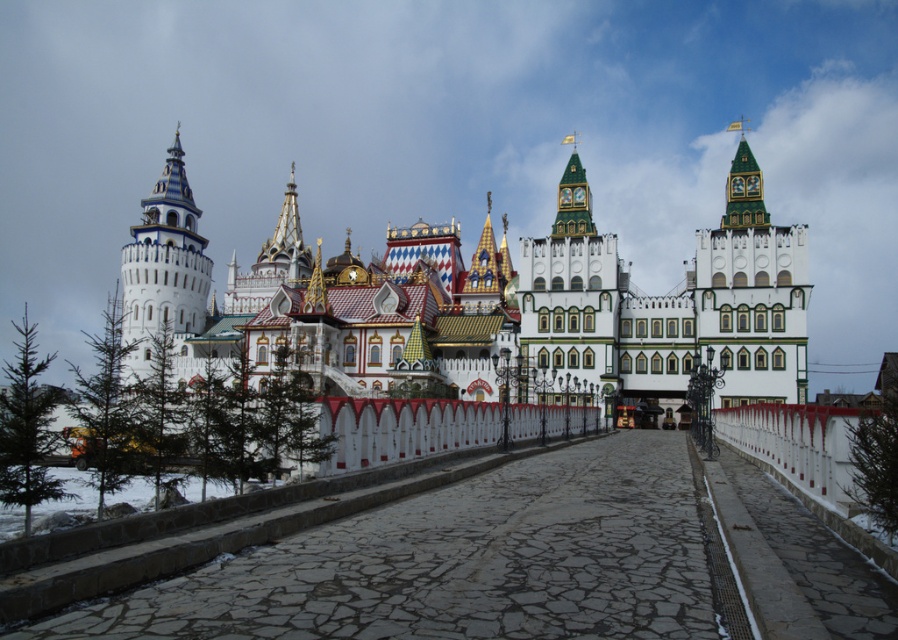
Question: Among these objects, which one is farthest from the camera?

Choices:
 (A) white painted stone tower at right
 (B) white painted stone castle at center
 (C) white painted wood clock tower at center
 (D) white painted stone tower at left

Answer: (C)

Question: Considering the relative positions of white painted stone tower at right and white painted stone tower at left in the image provided, where is white painted stone tower at right located with respect to white painted stone tower at left?

Choices:
 (A) above
 (B) below

Answer: (A)

Question: Does white painted stone tower at right appear under white painted wood clock tower at center?

Choices:
 (A) no
 (B) yes

Answer: (A)

Question: Among these points, which one is farthest from the camera?

Choices:
 (A) (198, 310)
 (B) (600, 292)
 (C) (753, 401)

Answer: (A)

Question: Among these points, which one is nearest to the camera?

Choices:
 (A) click(x=147, y=202)
 (B) click(x=587, y=326)
 (C) click(x=786, y=317)
 (D) click(x=703, y=228)

Answer: (C)

Question: Does white painted stone tower at right have a larger size compared to white painted wood clock tower at center?

Choices:
 (A) no
 (B) yes

Answer: (B)